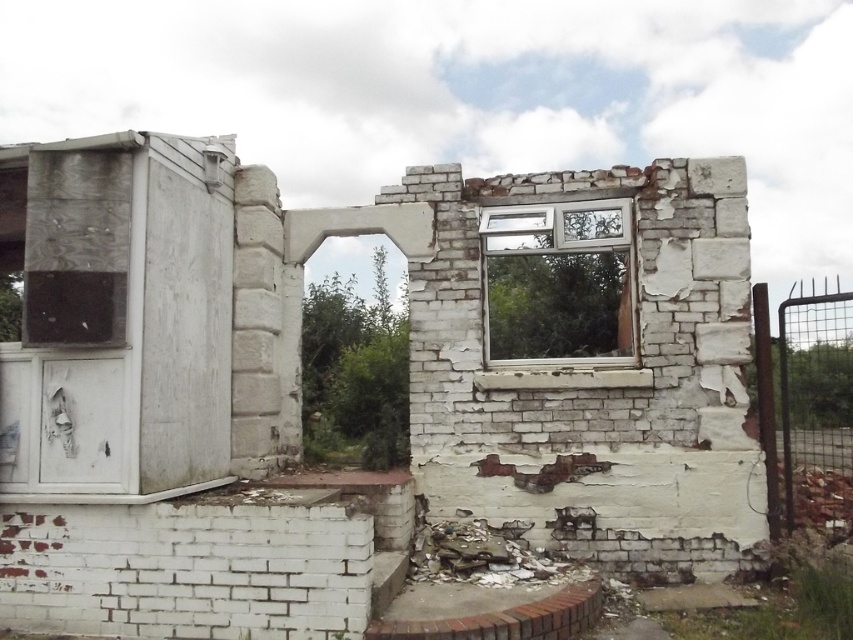
Who is positioned more to the right, white cracked brick ruins at center or clear glass window at center?

From the viewer's perspective, clear glass window at center appears more on the right side.

Between white cracked brick ruins at center and clear glass window at center, which one has less height?

With less height is clear glass window at center.

Is point (204, 256) closer to viewer compared to point (550, 262)?

That is True.

Locate an element on the screen. Image resolution: width=853 pixels, height=640 pixels. white cracked brick ruins at center is located at coordinates (300, 378).